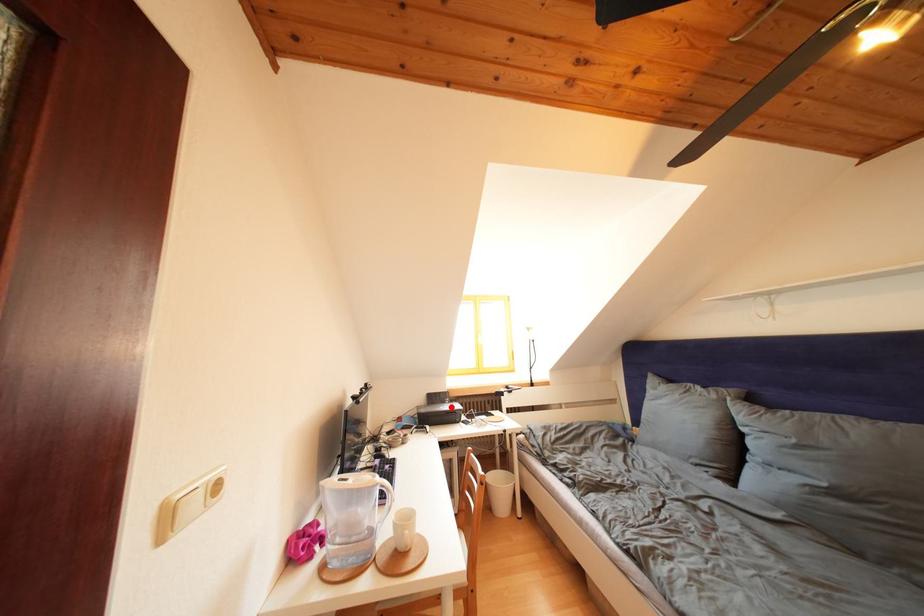
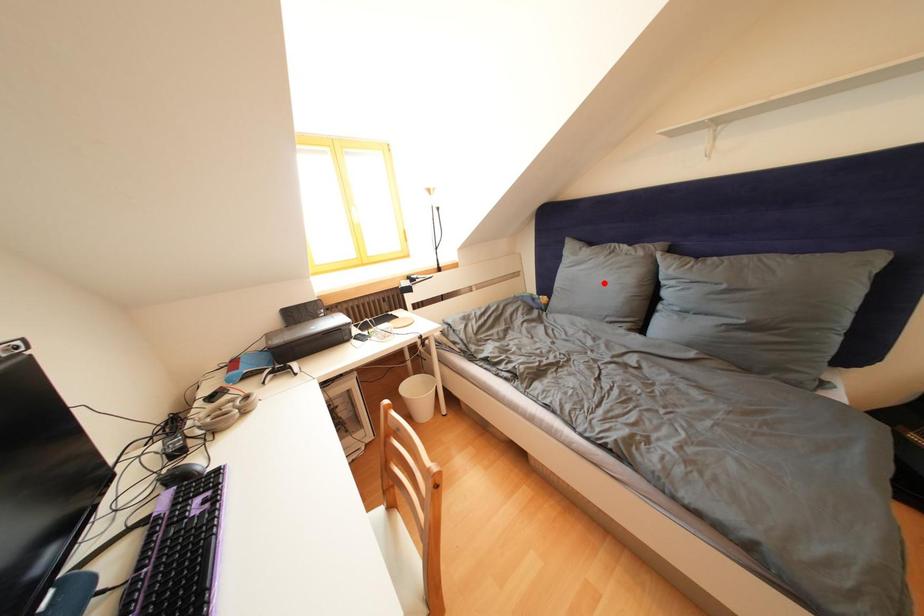
I am providing you with two images of the same scene from different viewpoints. A red point is marked on the first image and another point is marked on the second image. Does the point marked in image1 correspond to the same location as the one in image2?

No